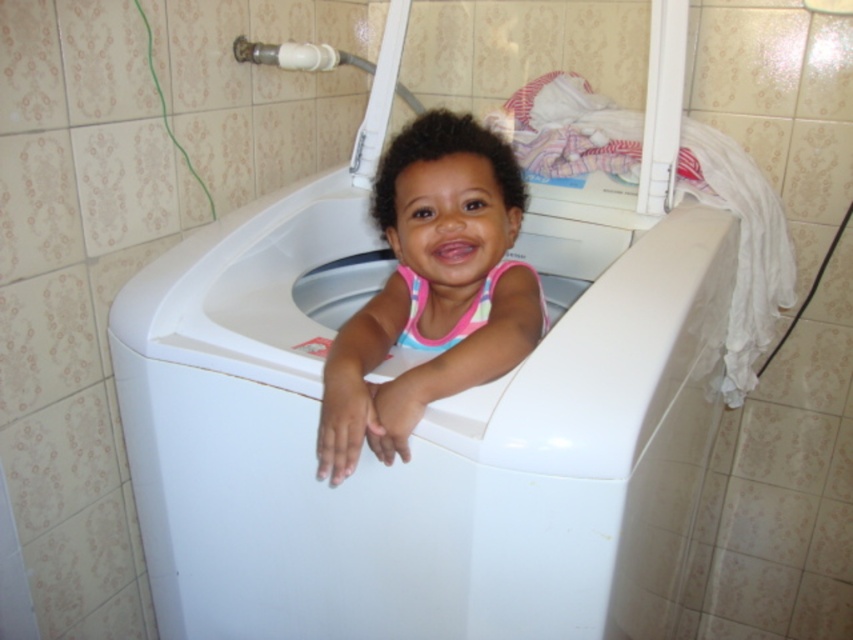
Find the location of a particular element. This screenshot has width=853, height=640. white plastic bathtub at center is located at coordinates (419, 440).

Who is more forward, (505, 632) or (465, 116)?

Positioned in front is point (505, 632).

The width and height of the screenshot is (853, 640). What are the coordinates of `white plastic bathtub at center` in the screenshot? It's located at (419, 440).